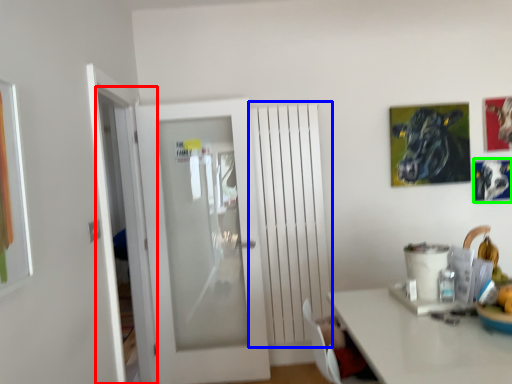
Question: Based on their relative distances, which object is farther from screen door (highlighted by a red box)? Choose from radiator (highlighted by a blue box) and picture frame (highlighted by a green box).

Choices:
 (A) radiator
 (B) picture frame

Answer: (B)